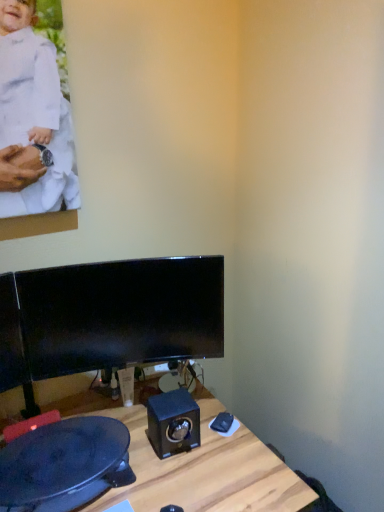
Question: Does wooden desk at center lie in front of white matte clothing at upper left?

Choices:
 (A) no
 (B) yes

Answer: (B)

Question: Is wooden desk at center positioned beyond the bounds of white matte clothing at upper left?

Choices:
 (A) yes
 (B) no

Answer: (A)

Question: Does wooden desk at center have a greater height compared to white matte clothing at upper left?

Choices:
 (A) yes
 (B) no

Answer: (A)

Question: Can white matte clothing at upper left be found inside wooden desk at center?

Choices:
 (A) no
 (B) yes

Answer: (A)

Question: Is wooden desk at center behind white matte clothing at upper left?

Choices:
 (A) no
 (B) yes

Answer: (A)

Question: Is black glossy monitor at center bigger or smaller than white matte clothing at upper left?

Choices:
 (A) big
 (B) small

Answer: (A)

Question: Is point (211, 353) positioned closer to the camera than point (64, 124)?

Choices:
 (A) farther
 (B) closer

Answer: (A)

Question: In terms of height, does black glossy monitor at center look taller or shorter compared to white matte clothing at upper left?

Choices:
 (A) tall
 (B) short

Answer: (B)

Question: Which is correct: black glossy monitor at center is inside white matte clothing at upper left, or outside of it?

Choices:
 (A) inside
 (B) outside

Answer: (B)

Question: In terms of width, does black glossy speaker at center look wider or thinner when compared to white matte clothing at upper left?

Choices:
 (A) thin
 (B) wide

Answer: (B)

Question: Considering the positions of black glossy speaker at center and white matte clothing at upper left in the image, is black glossy speaker at center bigger or smaller than white matte clothing at upper left?

Choices:
 (A) small
 (B) big

Answer: (A)

Question: In terms of height, does black glossy speaker at center look taller or shorter compared to white matte clothing at upper left?

Choices:
 (A) short
 (B) tall

Answer: (A)

Question: Considering their positions, is black glossy speaker at center located in front of or behind white matte clothing at upper left?

Choices:
 (A) front
 (B) behind

Answer: (B)

Question: From a real-world perspective, is black glossy monitor at center above or below black glossy speaker at center?

Choices:
 (A) below
 (B) above

Answer: (B)

Question: Is point (87, 282) positioned closer to the camera than point (155, 425)?

Choices:
 (A) farther
 (B) closer

Answer: (B)